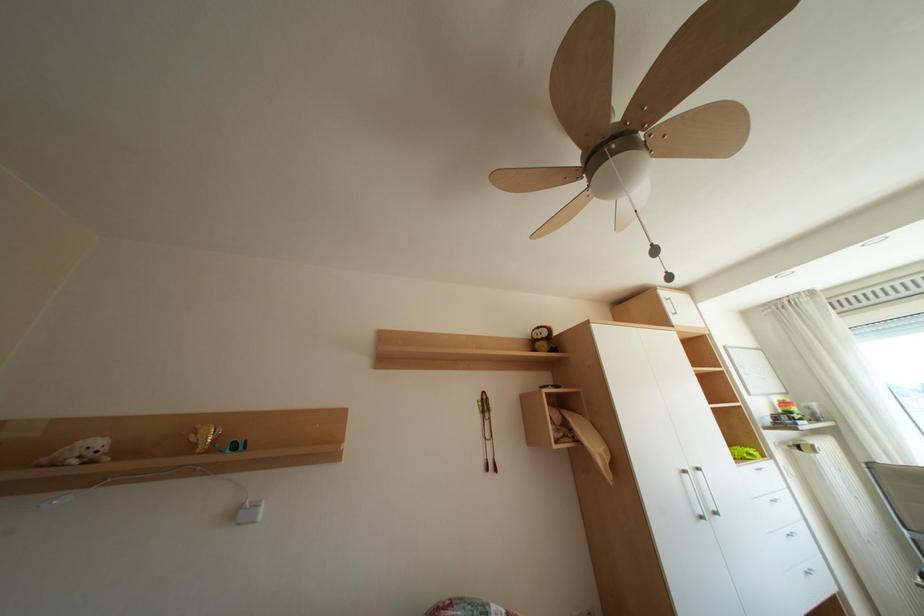
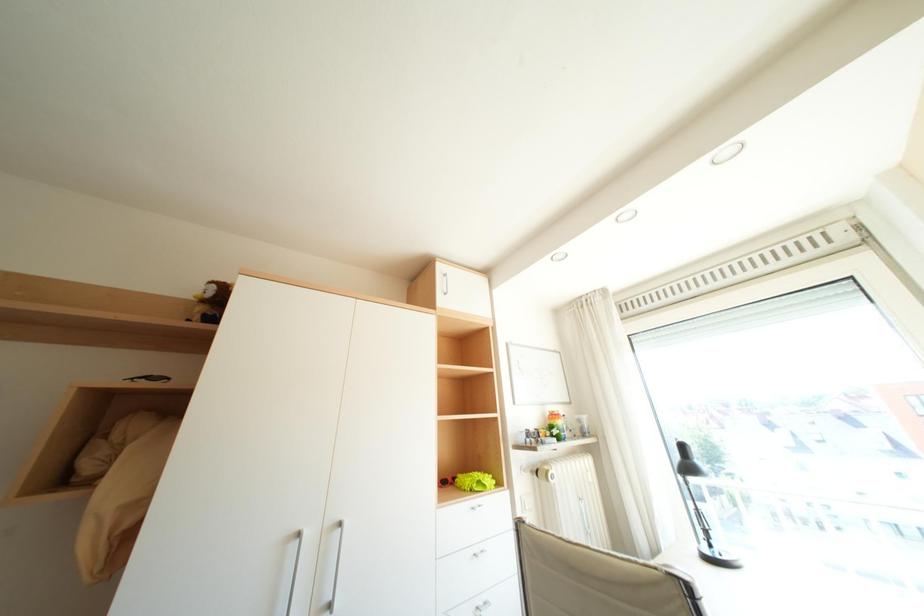
Question: In a continuous first-person perspective shot, in which direction is the camera moving?

Choices:
 (A) Left
 (B) Right
 (C) Forward
 (D) Backward

Answer: (B)